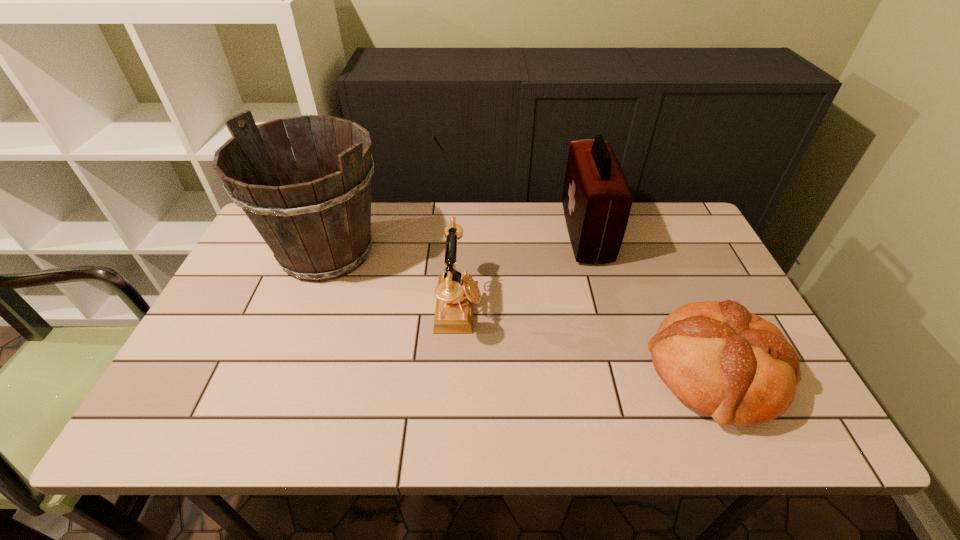
What are the coordinates of `the leftmost object` in the screenshot? It's located at click(316, 220).

The image size is (960, 540). Find the location of `the tallest object`. the tallest object is located at coordinates (316, 220).

Where is `the first aid kit`? The image size is (960, 540). the first aid kit is located at coordinates (597, 200).

At what (x,y) coordinates should I click in order to perform the action: click on the third object from right to left. Please return your answer as a coordinate pair (x, y). Image resolution: width=960 pixels, height=540 pixels. Looking at the image, I should click on (455, 293).

Locate an element on the screen. The height and width of the screenshot is (540, 960). the third tallest object is located at coordinates (455, 293).

What are the coordinates of `the shortest object` in the screenshot? It's located at (724, 362).

You are a GUI agent. You are given a task and a screenshot of the screen. Output one action in this format:
    pyautogui.click(x=<x>, y=<y>)
    Task: Click on the vacant space positioned 0.180m on the front of the bucket
    This screenshot has height=540, width=960.
    Given the screenshot: What is the action you would take?
    pyautogui.click(x=288, y=354)

At what (x,y) coordinates should I click in order to perform the action: click on free space located on the side of the first aid kit with the cross symbol. Please return your answer as a coordinate pair (x, y). The image size is (960, 540). Looking at the image, I should click on (462, 233).

This screenshot has height=540, width=960. Find the location of `free point located on the side of the first aid kit with the cross symbol`. free point located on the side of the first aid kit with the cross symbol is located at coordinates (474, 233).

Find the location of a particular element. vacant area located 0.320m on the side of the first aid kit with the cross symbol is located at coordinates (462, 233).